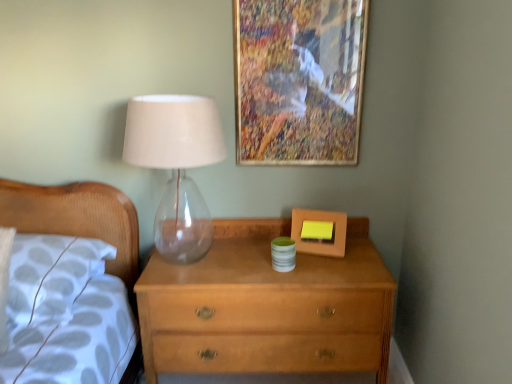
Question: Considering the relative sizes of transparent glass table lamp at left and matte wooden picture frame at center, which is counted as the first picture frame, starting from the bottom, in the image provided, is transparent glass table lamp at left taller than matte wooden picture frame at center, which is counted as the first picture frame, starting from the bottom,?

Choices:
 (A) yes
 (B) no

Answer: (A)

Question: Can you confirm if transparent glass table lamp at left is positioned to the left of matte wooden picture frame at center, the 2th picture frame in the top-to-bottom sequence?

Choices:
 (A) no
 (B) yes

Answer: (B)

Question: Does transparent glass table lamp at left have a smaller size compared to matte wooden picture frame at center, the 2th picture frame in the top-to-bottom sequence?

Choices:
 (A) yes
 (B) no

Answer: (B)

Question: Is transparent glass table lamp at left oriented towards matte wooden picture frame at center, which is counted as the first picture frame, starting from the bottom?

Choices:
 (A) yes
 (B) no

Answer: (B)

Question: From the image's perspective, is transparent glass table lamp at left under matte wooden picture frame at center, the 2th picture frame in the top-to-bottom sequence?

Choices:
 (A) yes
 (B) no

Answer: (B)

Question: Is transparent glass table lamp at left in contact with matte wooden picture frame at center, the 2th picture frame in the top-to-bottom sequence?

Choices:
 (A) no
 (B) yes

Answer: (A)

Question: Is there a large distance between light brown wood chest of drawers at center and wooden picture frame at upper center, the 1th picture frame viewed from the top?

Choices:
 (A) yes
 (B) no

Answer: (B)

Question: Considering the relative sizes of light brown wood chest of drawers at center and wooden picture frame at upper center, the 1th picture frame viewed from the top, in the image provided, is light brown wood chest of drawers at center taller than wooden picture frame at upper center, the 1th picture frame viewed from the top,?

Choices:
 (A) yes
 (B) no

Answer: (A)

Question: Is light brown wood chest of drawers at center completely or partially outside of wooden picture frame at upper center, the 1th picture frame viewed from the top?

Choices:
 (A) yes
 (B) no

Answer: (A)

Question: Is wooden picture frame at upper center, which appears as the 2th picture frame when ordered from the bottom, located within light brown wood chest of drawers at center?

Choices:
 (A) yes
 (B) no

Answer: (B)

Question: Is light brown wood chest of drawers at center further to the viewer compared to wooden picture frame at upper center, which appears as the 2th picture frame when ordered from the bottom?

Choices:
 (A) no
 (B) yes

Answer: (A)

Question: From a real-world perspective, is light brown wood chest of drawers at center on wooden picture frame at upper center, which appears as the 2th picture frame when ordered from the bottom?

Choices:
 (A) no
 (B) yes

Answer: (A)

Question: Can you confirm if white fabric pillow at left is shorter than transparent glass table lamp at left?

Choices:
 (A) yes
 (B) no

Answer: (A)